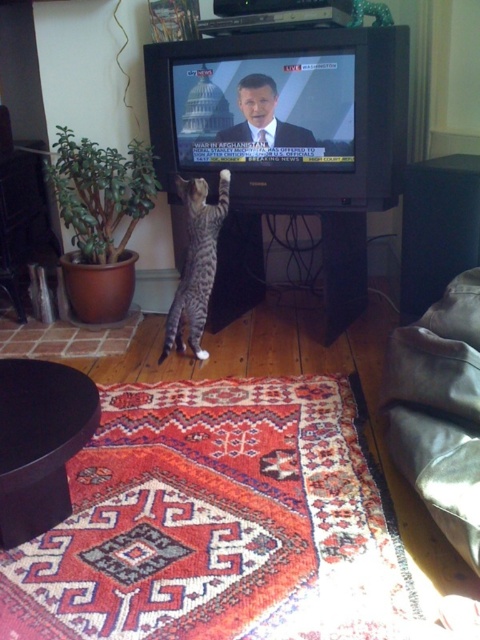
Question: Which object is closer to the camera taking this photo?

Choices:
 (A) striped fur cat at center
 (B) black plastic tv at center

Answer: (B)

Question: Can you confirm if black plastic tv at center is wider than striped fur cat at center?

Choices:
 (A) yes
 (B) no

Answer: (A)

Question: Is black plastic tv at center bigger than striped fur cat at center?

Choices:
 (A) yes
 (B) no

Answer: (A)

Question: Which point is farther to the camera?

Choices:
 (A) striped fur cat at center
 (B) black plastic tv at center

Answer: (A)

Question: Can you confirm if black plastic tv at center is positioned to the right of striped fur cat at center?

Choices:
 (A) yes
 (B) no

Answer: (A)